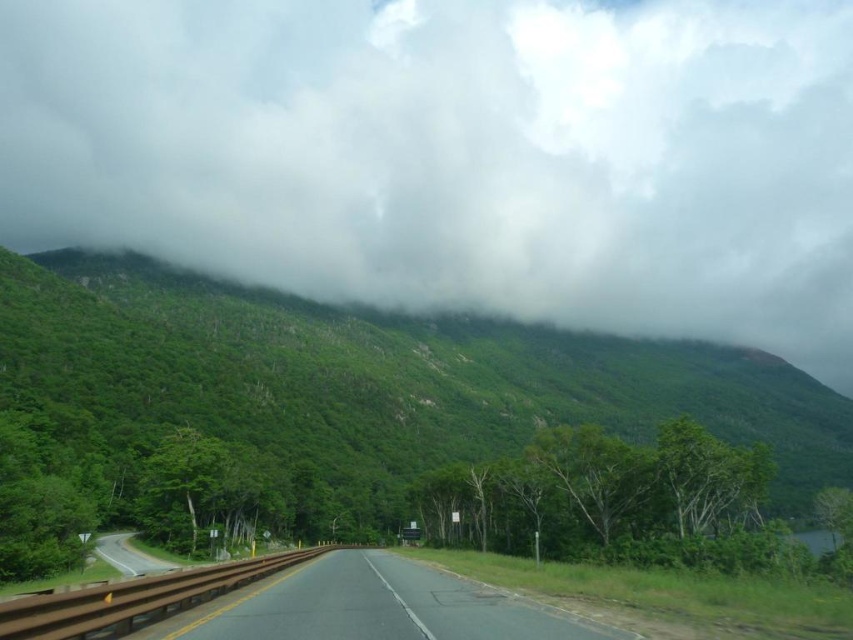
Is point (408, 602) in front of point (140, 572)?

Yes, point (408, 602) is in front of point (140, 572).

Can you confirm if black asphalt highway at center is shorter than asphalt road at lower left?

In fact, black asphalt highway at center may be taller than asphalt road at lower left.

Is point (515, 602) positioned after point (175, 564)?

No, (515, 602) is in front of (175, 564).

I want to click on black asphalt highway at center, so click(375, 605).

Can you confirm if white fluffy cloud at upper center is wider than green leafy forest at upper center?

Correct, the width of white fluffy cloud at upper center exceeds that of green leafy forest at upper center.

Between white fluffy cloud at upper center and green leafy forest at upper center, which one appears on the right side from the viewer's perspective?

green leafy forest at upper center

This screenshot has height=640, width=853. Describe the element at coordinates (456, 154) in the screenshot. I see `white fluffy cloud at upper center` at that location.

Image resolution: width=853 pixels, height=640 pixels. Find the location of `white fluffy cloud at upper center`. white fluffy cloud at upper center is located at coordinates (456, 154).

Is point (460, 324) behind point (488, 616)?

Yes, point (460, 324) is behind point (488, 616).

Between green leafy forest at upper center and black asphalt highway at center, which one has more height?

With more height is green leafy forest at upper center.

Measure the distance between green leafy forest at upper center and camera.

78.19 meters

Find the location of a particular element. green leafy forest at upper center is located at coordinates (372, 380).